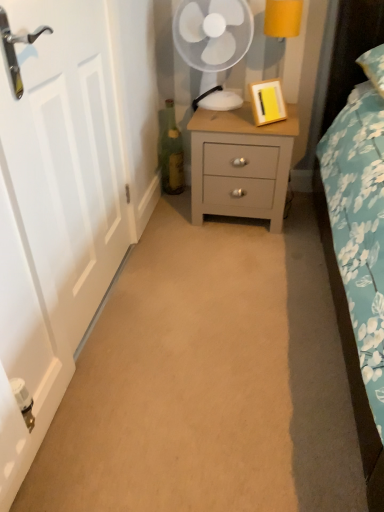
At what (x,y) coordinates should I click in order to perform the action: click on green glass bottle at center. Please return your answer as a coordinate pair (x, y). Looking at the image, I should click on (170, 151).

Image resolution: width=384 pixels, height=512 pixels. I want to click on white matte door at left, so click(54, 210).

The image size is (384, 512). Identify the location of green glass bottle at center. pyautogui.click(x=170, y=151).

Which is closer to the camera, (84, 323) or (161, 141)?

Point (84, 323).

Locate an element on the screen. This screenshot has width=384, height=512. door that is on the left side of green glass bottle at center is located at coordinates (54, 210).

How far apart are white matte door at left and green glass bottle at center?

A distance of 38.73 inches exists between white matte door at left and green glass bottle at center.

From the picture: Between white matte door at left and green glass bottle at center, which one has larger width?

Wider between the two is green glass bottle at center.

Is yellow fabric lampshade at upper right not near white matte door at left?

Yes, yellow fabric lampshade at upper right and white matte door at left are quite far apart.

Is yellow fabric lampshade at upper right aimed at white matte door at left?

No, yellow fabric lampshade at upper right does not turn towards white matte door at left.

Is yellow fabric lampshade at upper right smaller than white matte door at left?

Indeed, yellow fabric lampshade at upper right has a smaller size compared to white matte door at left.

Which of these two, yellow fabric lampshade at upper right or white matte door at left, stands shorter?

yellow fabric lampshade at upper right.

Is white plastic mechanical fan at upper center facing away from yellow fabric lampshade at upper right?

No, white plastic mechanical fan at upper center is not facing away from yellow fabric lampshade at upper right.

From the picture: Is white plastic mechanical fan at upper center wider than yellow fabric lampshade at upper right?

Yes.

From the image's perspective, is white plastic mechanical fan at upper center above or below yellow fabric lampshade at upper right?

white plastic mechanical fan at upper center is above yellow fabric lampshade at upper right.

Where is `mechanical fan that is above the yellow fabric lampshade at upper right (from a real-world perspective)`? The width and height of the screenshot is (384, 512). mechanical fan that is above the yellow fabric lampshade at upper right (from a real-world perspective) is located at coordinates (213, 34).

Which object is positioned more to the left, yellow fabric lampshade at upper right or matte gray nightstand at center?

Positioned to the left is matte gray nightstand at center.

Locate an element on the screen. The height and width of the screenshot is (512, 384). bedside lamp above the matte gray nightstand at center (from the image's perspective) is located at coordinates (283, 18).

Which object is closer to the camera taking this photo, yellow fabric lampshade at upper right or matte gray nightstand at center?

yellow fabric lampshade at upper right is more forward.

From a real-world perspective, is yellow fabric lampshade at upper right under matte gray nightstand at center?

No, from a real-world perspective, yellow fabric lampshade at upper right is not under matte gray nightstand at center.

Is yellow matte picture frame at upper right thinner than yellow fabric lampshade at upper right?

Correct, the width of yellow matte picture frame at upper right is less than that of yellow fabric lampshade at upper right.

In the scene shown: Is yellow matte picture frame at upper right bigger than yellow fabric lampshade at upper right?

Actually, yellow matte picture frame at upper right might be smaller than yellow fabric lampshade at upper right.

From a real-world perspective, which is physically below, yellow matte picture frame at upper right or yellow fabric lampshade at upper right?

yellow matte picture frame at upper right, from a real-world perspective.

Would you say yellow fabric lampshade at upper right is part of yellow matte picture frame at upper right's contents?

No.

Locate an element on the screen. This screenshot has height=512, width=384. bottle behind the yellow matte picture frame at upper right is located at coordinates (170, 151).

Is point (165, 164) farther from viewer compared to point (263, 100)?

Yes, it is.

Between green glass bottle at center and yellow matte picture frame at upper right, which one is positioned behind?

green glass bottle at center is further from the camera.

Considering the sizes of objects green glass bottle at center and yellow matte picture frame at upper right in the image provided, who is thinner, green glass bottle at center or yellow matte picture frame at upper right?

green glass bottle at center.

How far apart are white matte door at left and yellow matte picture frame at upper right?

white matte door at left is 93.41 centimeters away from yellow matte picture frame at upper right.

Could yellow matte picture frame at upper right be considered to be inside white matte door at left?

Actually, yellow matte picture frame at upper right is outside white matte door at left.

Who is taller, white matte door at left or yellow matte picture frame at upper right?

Standing taller between the two is white matte door at left.

Where is `door that is above the green glass bottle at center (from a real-world perspective)`? door that is above the green glass bottle at center (from a real-world perspective) is located at coordinates (54, 210).

Where is `door in front of the yellow fabric lampshade at upper right`? The width and height of the screenshot is (384, 512). door in front of the yellow fabric lampshade at upper right is located at coordinates (54, 210).

Considering their positions, is green glass bottle at center positioned further to white plastic mechanical fan at upper center than white matte door at left?

Based on the image, white matte door at left appears to be further to white plastic mechanical fan at upper center.

Estimate the real-world distances between objects in this image. Which object is further from yellow matte picture frame at upper right, matte gray nightstand at center or yellow fabric lampshade at upper right?

yellow fabric lampshade at upper right is further to yellow matte picture frame at upper right.

From the picture: Looking at the image, which one is located closer to yellow fabric lampshade at upper right, white matte door at left or green glass bottle at center?

Based on the image, green glass bottle at center appears to be nearer to yellow fabric lampshade at upper right.

Considering their positions, is yellow matte picture frame at upper right positioned further to matte gray nightstand at center than green glass bottle at center?

The object further to matte gray nightstand at center is green glass bottle at center.

When comparing their distances from yellow matte picture frame at upper right, does white matte door at left or green glass bottle at center seem further?

white matte door at left is further to yellow matte picture frame at upper right.

When comparing their distances from white matte door at left, does white plastic mechanical fan at upper center or yellow matte picture frame at upper right seem closer?

white plastic mechanical fan at upper center is closer to white matte door at left.

Looking at the image, which one is located closer to yellow matte picture frame at upper right, white matte door at left or yellow fabric lampshade at upper right?

Based on the image, yellow fabric lampshade at upper right appears to be nearer to yellow matte picture frame at upper right.

Considering their positions, is white plastic mechanical fan at upper center positioned further to green glass bottle at center than matte gray nightstand at center?

matte gray nightstand at center is positioned further to the anchor green glass bottle at center.

The height and width of the screenshot is (512, 384). I want to click on picture frame located between white matte door at left and yellow fabric lampshade at upper right in the depth direction, so click(267, 102).

Locate an element on the screen. nightstand between green glass bottle at center and yellow fabric lampshade at upper right in the horizontal direction is located at coordinates (243, 166).

Locate an element on the screen. Image resolution: width=384 pixels, height=512 pixels. bedside lamp located between white matte door at left and matte gray nightstand at center in the depth direction is located at coordinates coord(283,18).

At what (x,y) coordinates should I click in order to perform the action: click on nightstand positioned between white matte door at left and green glass bottle at center from near to far. Please return your answer as a coordinate pair (x, y). The image size is (384, 512). Looking at the image, I should click on (243, 166).